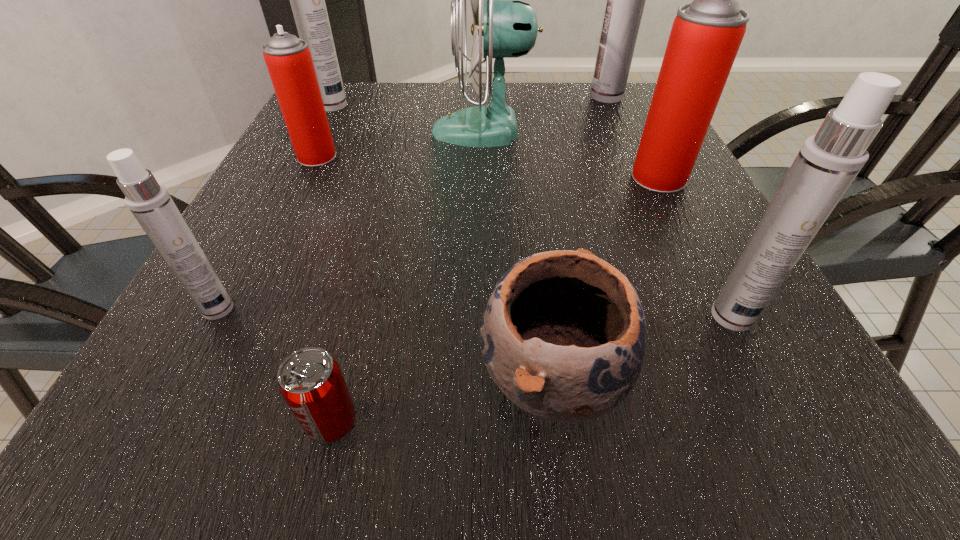
Find the location of a particular element. the tallest aerosol can is located at coordinates (625, 0).

What are the coordinates of `the tallest object` in the screenshot? It's located at (625, 0).

Identify the location of the second biggest white aerosol can. (307, 0).

You are a GUI agent. You are given a task and a screenshot of the screen. Output one action in this format:
    pyautogui.click(x=<x>, y=<y>)
    Task: Click on the fan
    Image resolution: width=960 pixels, height=540 pixels.
    Given the screenshot: What is the action you would take?
    pyautogui.click(x=509, y=29)

The width and height of the screenshot is (960, 540). I want to click on the bigger red aerosol can, so click(x=706, y=34).

This screenshot has height=540, width=960. Identify the location of the second smallest white aerosol can. (828, 162).

Identify the location of the smaller red aerosol can. The height and width of the screenshot is (540, 960). (288, 59).

In order to click on the smallest white aerosol can in this screenshot , I will do `click(150, 203)`.

The image size is (960, 540). In order to click on blue pottery in this screenshot , I will do `click(563, 336)`.

I want to click on the second shortest object, so click(x=563, y=336).